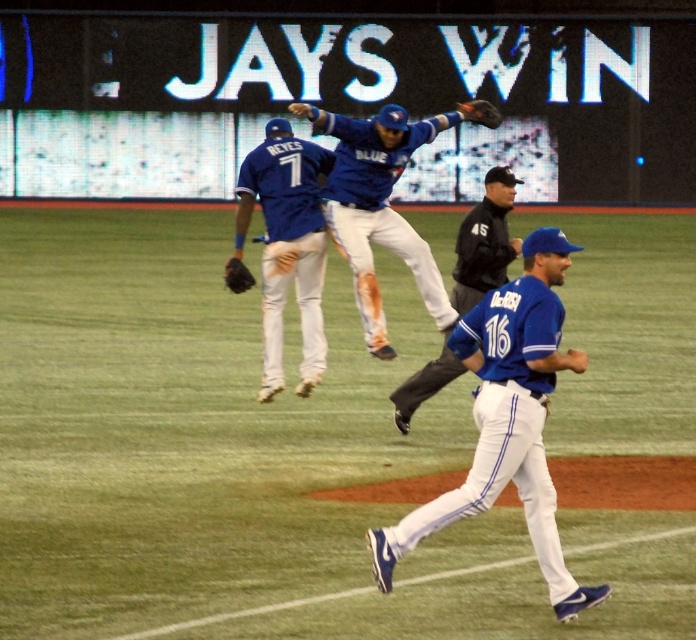
Question: Is blue jersey at center bigger than black leather jacket at center?

Choices:
 (A) no
 (B) yes

Answer: (B)

Question: Which of the following is the closest to the observer?

Choices:
 (A) (441, 522)
 (B) (475, 116)
 (C) (416, 272)

Answer: (A)

Question: Which of the following is the closest to the observer?

Choices:
 (A) pos(505,461)
 (B) pos(436,116)
 (C) pos(490,115)
 (D) pos(245,202)

Answer: (A)

Question: Does black leather jacket at center have a lesser width compared to black leather glove at center?

Choices:
 (A) yes
 (B) no

Answer: (B)

Question: Which of the following is the farthest from the observer?

Choices:
 (A) matte blue jersey at upper left
 (B) dark brown leather glove at upper center
 (C) black leather jacket at center

Answer: (A)

Question: Can you confirm if matte blue jersey at center is positioned to the left of matte blue jersey at upper left?

Choices:
 (A) yes
 (B) no

Answer: (B)